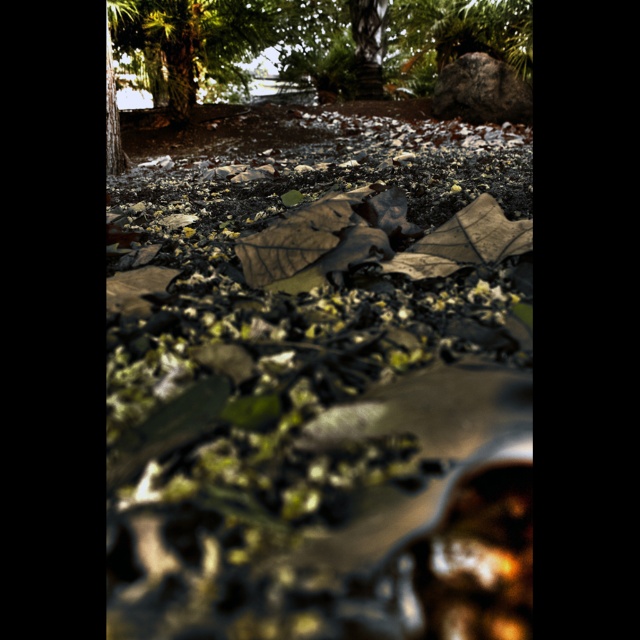
Can you confirm if brown leaf litter at center is shorter than green leafy tree at upper left?

Yes.

Find the location of a particular element. The image size is (640, 640). brown leaf litter at center is located at coordinates (323, 385).

At what (x,y) coordinates should I click in order to perform the action: click on brown leaf litter at center. Please return your answer as a coordinate pair (x, y). This screenshot has height=640, width=640. Looking at the image, I should click on (323, 385).

Locate an element on the screen. The width and height of the screenshot is (640, 640). brown leaf litter at center is located at coordinates (323, 385).

Which of these two, brown leaf litter at center or rough gray rock at upper right, stands taller?

rough gray rock at upper right is taller.

Is brown leaf litter at center to the left of rough gray rock at upper right from the viewer's perspective?

Yes, brown leaf litter at center is to the left of rough gray rock at upper right.

Is point (108, 218) positioned behind point (493, 115)?

No, it is not.

Locate an element on the screen. This screenshot has width=640, height=640. brown leaf litter at center is located at coordinates (323, 385).

Is point (124, 38) more distant than point (477, 56)?

No, it is not.

Does green leafy tree at upper left come in front of rough gray rock at upper right?

That is True.

Does point (257, 38) lie in front of point (490, 99)?

No.

What are the coordinates of `green leafy tree at upper left` in the screenshot? It's located at (189, 45).